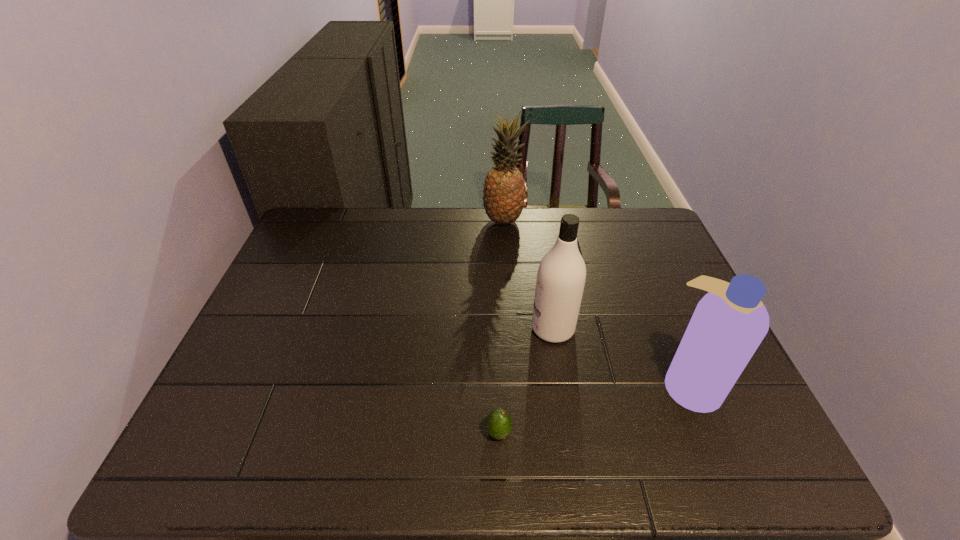
In the image, there is a desktop. Where is `vacant space at the far right corner`? vacant space at the far right corner is located at coordinates (668, 250).

Identify the location of free space between the nearer shampoo and the avocado. The height and width of the screenshot is (540, 960). (593, 409).

In order to click on vacant area that lies between the pineapple and the third nearest object in this screenshot , I will do `click(528, 275)`.

Identify the location of vacant area that lies between the farther shampoo and the nearer shampoo. (621, 357).

Find the location of a particular element. The image size is (960, 540). free space between the third farthest object and the farther shampoo is located at coordinates (621, 357).

You are a GUI agent. You are given a task and a screenshot of the screen. Output one action in this format:
    pyautogui.click(x=<x>, y=<y>)
    Task: Click on the vacant point located between the nearest object and the nearer shampoo
    
    Given the screenshot: What is the action you would take?
    pyautogui.click(x=593, y=409)

Locate an element on the screen. The height and width of the screenshot is (540, 960). unoccupied area between the right shampoo and the third nearest object is located at coordinates [621, 357].

Locate an element on the screen. free space between the third nearest object and the rightmost object is located at coordinates (621, 357).

Find the location of a particular element. The image size is (960, 540). free space between the farthest object and the third nearest object is located at coordinates (528, 275).

Image resolution: width=960 pixels, height=540 pixels. What are the coordinates of `free space that is in between the farthest object and the nearest object` in the screenshot? It's located at (501, 327).